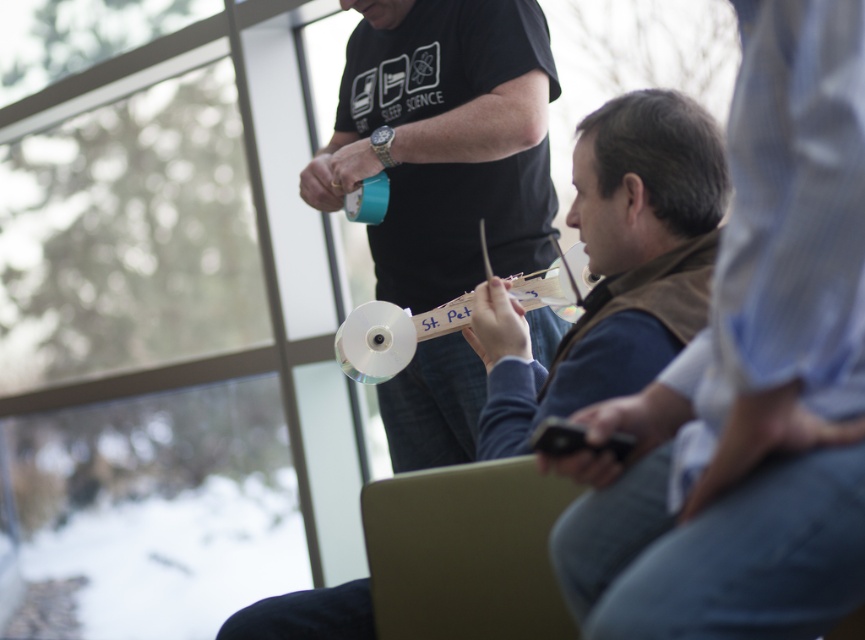
Does blue denim jeans at center have a greater height compared to matte black t-shirt at center?

Incorrect, blue denim jeans at center's height is not larger of matte black t-shirt at center's.

Which is more to the left, blue denim jeans at center or matte black t-shirt at center?

matte black t-shirt at center

Is point (646, 531) less distant than point (380, 262)?

Yes, it is.

Where is `blue denim jeans at center`? The image size is (865, 640). blue denim jeans at center is located at coordinates (748, 378).

Between blue denim jeans at center and matte white cd at center, which one is positioned lower?

Positioned lower is matte white cd at center.

Is blue denim jeans at center closer to camera compared to matte white cd at center?

Yes, blue denim jeans at center is closer to the viewer.

Is point (798, 397) behind point (613, 116)?

No, (798, 397) is closer to viewer.

Identify the location of blue denim jeans at center. (748, 378).

Does matte black t-shirt at center have a lesser height compared to matte white cd at center?

No.

Who is more forward, (306, 170) or (587, 380)?

Point (587, 380) is in front.

I want to click on matte black t-shirt at center, so click(x=445, y=140).